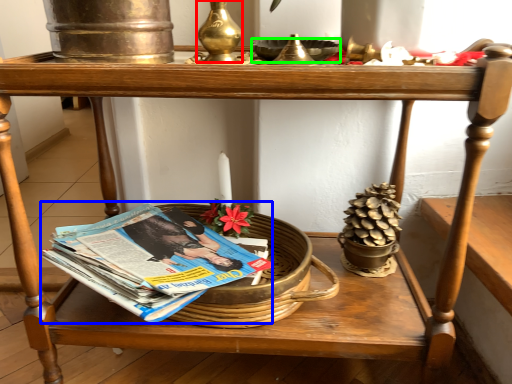
Question: Based on their relative distances, which object is nearer to candle holder (highlighted by a red box)? Choose from paperback book (highlighted by a blue box) and bowl (highlighted by a green box).

Choices:
 (A) paperback book
 (B) bowl

Answer: (B)